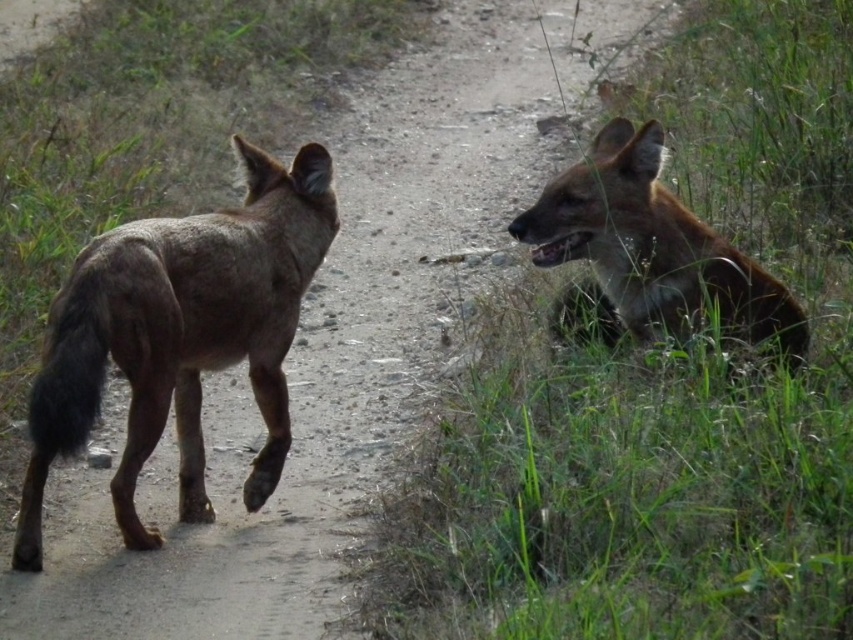
Question: Can you confirm if green grass at lower right is bigger than brown fur dog at left?

Choices:
 (A) yes
 (B) no

Answer: (A)

Question: Which object is the closest to the brown fur hyaena at right?

Choices:
 (A) brown fur dog at left
 (B) green grass at lower right

Answer: (B)

Question: Which object is closer to the camera taking this photo?

Choices:
 (A) brown fur dog at left
 (B) brown fur hyaena at right

Answer: (A)

Question: Can you confirm if green grass at lower right is positioned below brown fur dog at left?

Choices:
 (A) no
 (B) yes

Answer: (B)

Question: Which point is farther from the camera taking this photo?

Choices:
 (A) (743, 157)
 (B) (129, 518)
 (C) (599, 141)

Answer: (A)

Question: Is brown fur dog at left behind brown fur hyaena at right?

Choices:
 (A) no
 (B) yes

Answer: (A)